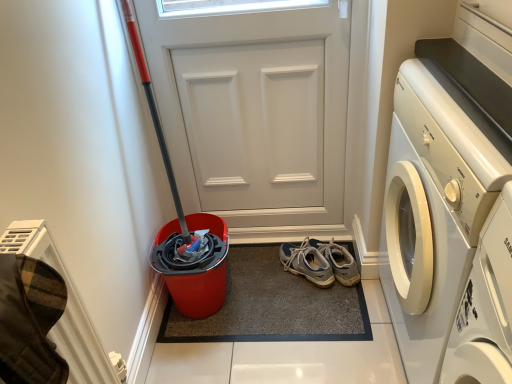
Find the location of `vacant space situated above carpeted mat at center (from a real-world perspective)`. vacant space situated above carpeted mat at center (from a real-world perspective) is located at coordinates (272, 289).